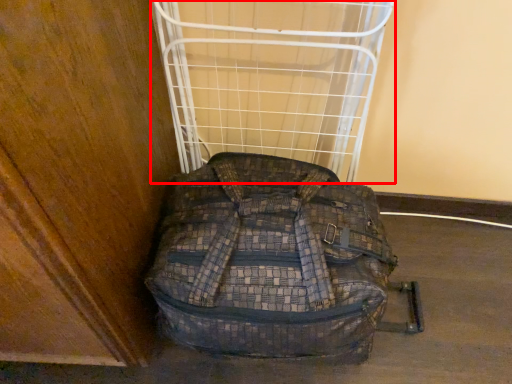
Question: In this image, where is cage (annotated by the red box) located relative to backpack?

Choices:
 (A) left
 (B) right

Answer: (A)